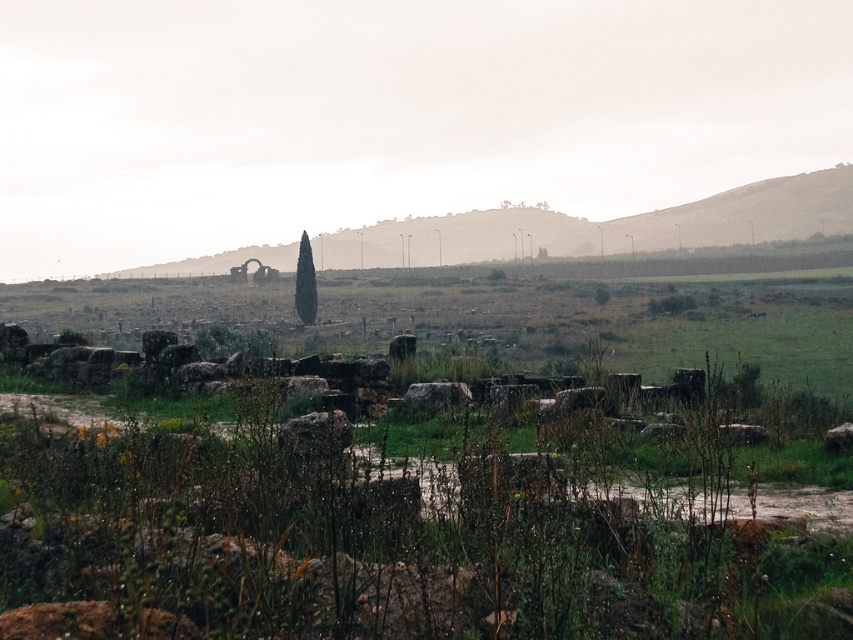
Who is positioned more to the right, rustic stone hillside at upper center or green leafy tree at center?

Positioned to the right is rustic stone hillside at upper center.

Between rustic stone hillside at upper center and green leafy tree at center, which one appears on the left side from the viewer's perspective?

From the viewer's perspective, green leafy tree at center appears more on the left side.

This screenshot has height=640, width=853. What do you see at coordinates (604, 227) in the screenshot?
I see `rustic stone hillside at upper center` at bounding box center [604, 227].

Identify the location of rustic stone hillside at upper center. This screenshot has height=640, width=853. (604, 227).